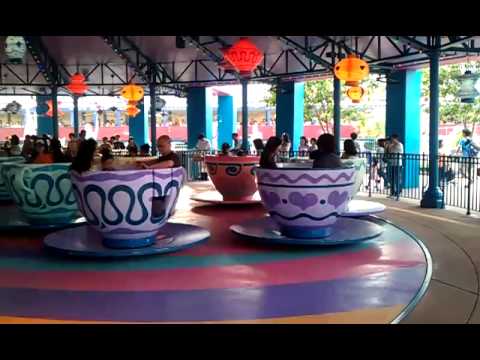
You are a GUI agent. You are given a task and a screenshot of the screen. Output one action in this format:
    pyautogui.click(x=<x>, y=<y>)
    Task: Click on the yellow stripe pattern on floor
    This screenshot has height=360, width=480.
    Given the screenshot: What is the action you would take?
    pyautogui.click(x=358, y=318)